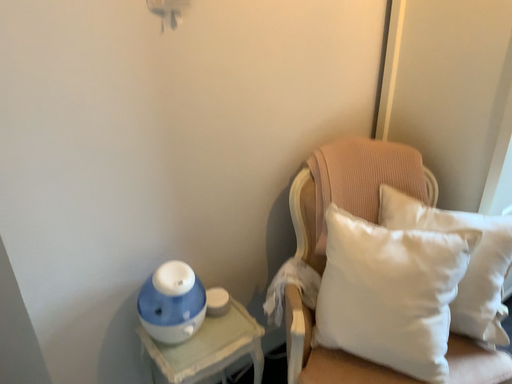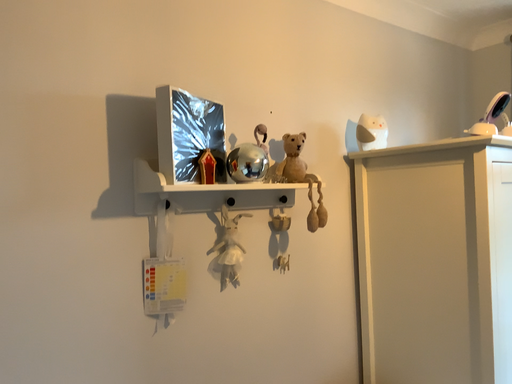
Question: How did the camera likely rotate when shooting the video?

Choices:
 (A) rotated downward
 (B) rotated upward

Answer: (B)